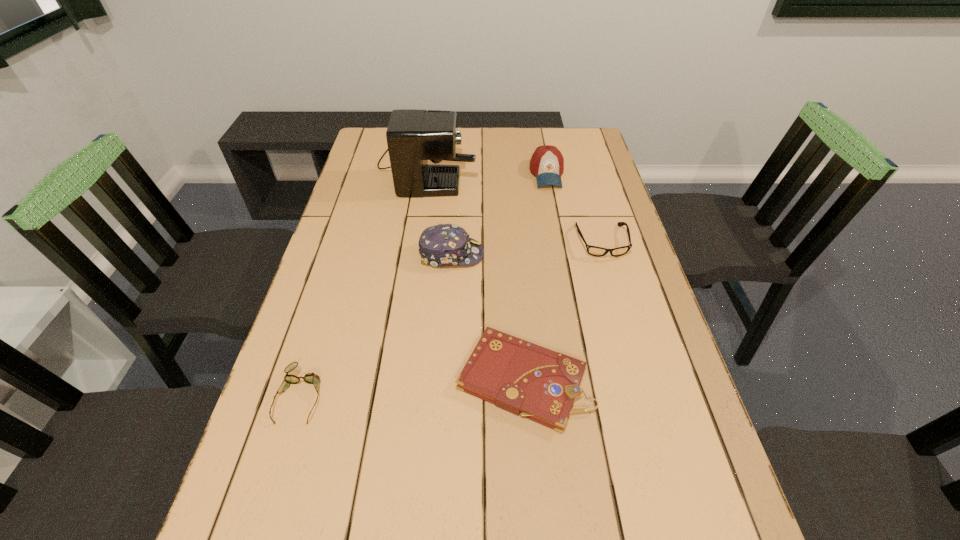
Where is `vacant space situated 0.390m on the front-facing side of the headwear`? This screenshot has width=960, height=540. vacant space situated 0.390m on the front-facing side of the headwear is located at coordinates (624, 254).

Locate an element on the screen. vacant position located 0.310m on the front-facing side of the farther spectacles is located at coordinates (635, 355).

The height and width of the screenshot is (540, 960). Find the location of `vacant area situated on the back of the notebook`. vacant area situated on the back of the notebook is located at coordinates (514, 253).

Where is `vacant space situated 0.070m on the front-facing side of the left spectacles`? vacant space situated 0.070m on the front-facing side of the left spectacles is located at coordinates (280, 461).

Image resolution: width=960 pixels, height=540 pixels. In order to click on coffee maker positioned at the far edge in this screenshot , I will do `click(413, 136)`.

Where is `baseball cap that is at the far edge`? This screenshot has width=960, height=540. baseball cap that is at the far edge is located at coordinates (547, 163).

The width and height of the screenshot is (960, 540). Identify the location of coffee maker positioned at the left edge. (413, 136).

This screenshot has height=540, width=960. What are the coordinates of `spectacles situated at the left edge` in the screenshot? It's located at (311, 378).

This screenshot has width=960, height=540. I want to click on baseball cap that is at the right edge, so click(547, 163).

The height and width of the screenshot is (540, 960). In order to click on spectacles at the right edge in this screenshot , I will do `click(595, 251)`.